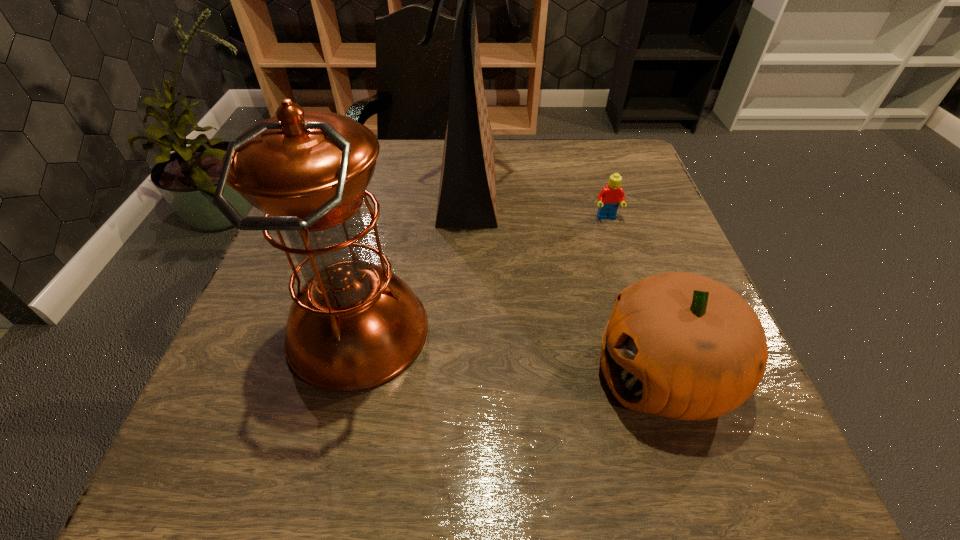
Locate which object ranks third in proximity to the tallest object. Please provide its 2D coordinates. Your answer should be formatted as a tuple, i.e. [(x, y)], where the tuple contains the x and y coordinates of a point satisfying the conditions above.

[(680, 345)]